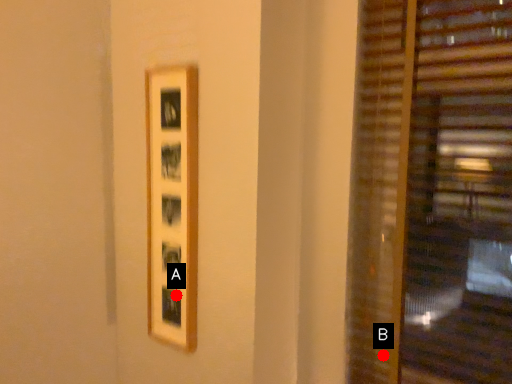
Question: Two points are circled on the image, labeled by A and B beside each circle. Among these points, which one is nearest to the camera?

Choices:
 (A) A is closer
 (B) B is closer

Answer: (B)